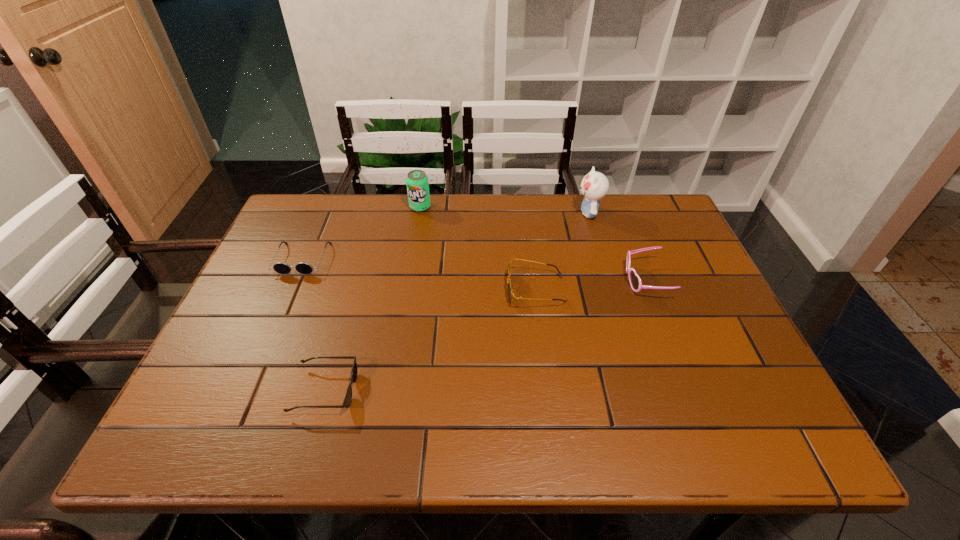
Where is `free space located on the front-facing side of the kitten`? The width and height of the screenshot is (960, 540). free space located on the front-facing side of the kitten is located at coordinates (516, 213).

Locate an element on the screen. vacant space located 0.350m on the front-facing side of the kitten is located at coordinates (460, 213).

The image size is (960, 540). In order to click on vacant area situated on the front-facing side of the second tallest object in this screenshot , I will do [x=405, y=296].

Identify the location of free space located on the front-facing side of the rightmost sunglasses. This screenshot has width=960, height=540. (473, 280).

Identify the location of free space located 0.360m on the front-facing side of the rightmost sunglasses. The width and height of the screenshot is (960, 540). (485, 280).

You are a GUI agent. You are given a task and a screenshot of the screen. Output one action in this format:
    pyautogui.click(x=<x>, y=<y>)
    Task: Click on the vacant position located 0.150m on the front-facing side of the rightmost sunglasses
    Image resolution: width=960 pixels, height=540 pixels.
    Given the screenshot: What is the action you would take?
    pyautogui.click(x=566, y=280)

Image resolution: width=960 pixels, height=540 pixels. What are the coordinates of `vacant space located on the front-facing side of the third sunglasses from left to right` in the screenshot? It's located at 467,290.

I want to click on free space located 0.160m on the front-facing side of the third sunglasses from left to right, so click(x=444, y=290).

At what (x,y) coordinates should I click in order to perform the action: click on free space located on the front-facing side of the third sunglasses from left to right. Please return your answer as a coordinate pair (x, y). Image resolution: width=960 pixels, height=540 pixels. Looking at the image, I should click on (439, 290).

The height and width of the screenshot is (540, 960). Find the location of `free space located 0.280m on the front-facing side of the leftmost object`. free space located 0.280m on the front-facing side of the leftmost object is located at coordinates (256, 366).